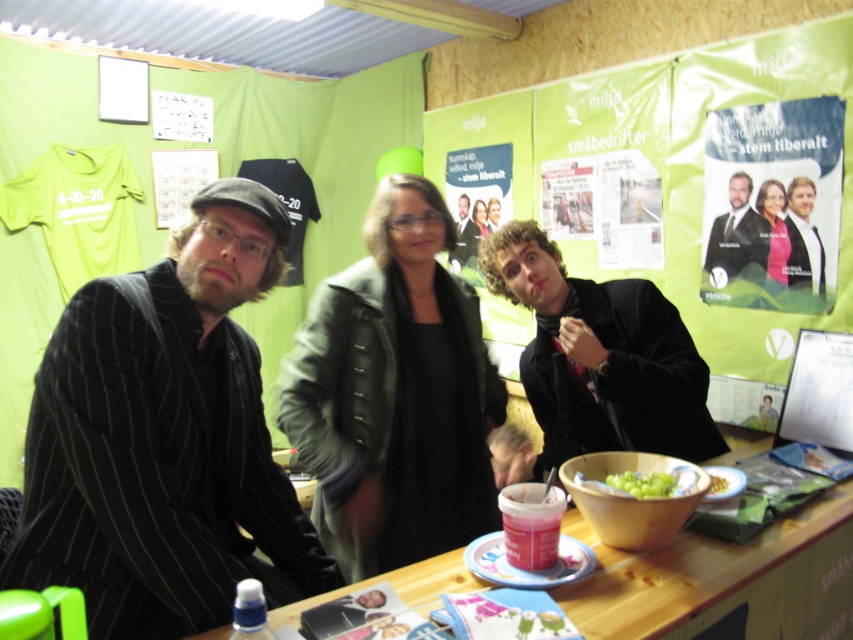
Question: Is leather jacket at center below matte black jacket at center?

Choices:
 (A) yes
 (B) no

Answer: (A)

Question: Does matte black suit at center appear on the left side of smooth black suit at center?

Choices:
 (A) no
 (B) yes

Answer: (A)

Question: Which point appears closest to the camera in this image?

Choices:
 (A) (473, 204)
 (B) (790, 220)

Answer: (B)

Question: Among these objects, which one is nearest to the camera?

Choices:
 (A) smooth black suit at center
 (B) matte black suit at center
 (C) smooth black suit at upper right
 (D) shiny black jacket at center

Answer: (D)

Question: Which of the following is the closest to the observer?

Choices:
 (A) leather jacket at center
 (B) smooth black suit at upper right

Answer: (A)

Question: Observing the image, what is the correct spatial positioning of wooden table at lower center in reference to green matte grapes at center?

Choices:
 (A) right
 (B) left

Answer: (B)